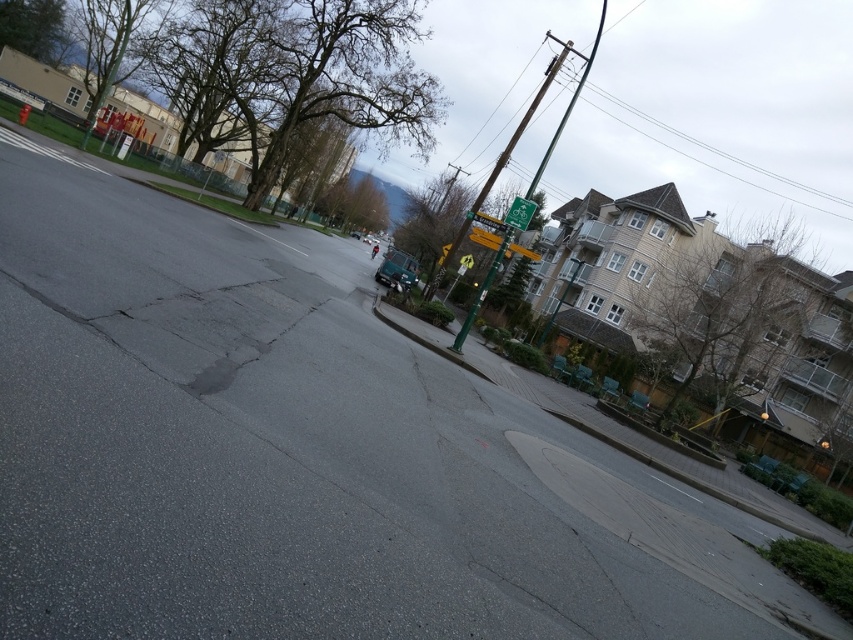
You are standing at the point closer to the camera in this urban street scene. There are two points marked on the road ahead of you at coordinates point (387, 268) and point (482, 240). Which point is farther away from your current position?

Point (482, 240) is farther away from your current position because it is closer to the horizon than point (387, 268), which is closer to the camera.

You are a pedestrian standing on the sidewalk looking down the road. You see a green plastic sign at upper center and a green plastic traffic sign at center. Which sign is higher up in the image?

The green plastic sign at upper center is higher up in the image than the green plastic traffic sign at center.

Consider the image. You are a delivery driver approaching the curved road in the image. You notice two green plastic signs ahead. Which one is wider, the green plastic sign at upper center or the green plastic traffic sign at center?

The green plastic sign at upper center is wider than the green plastic traffic sign at center.